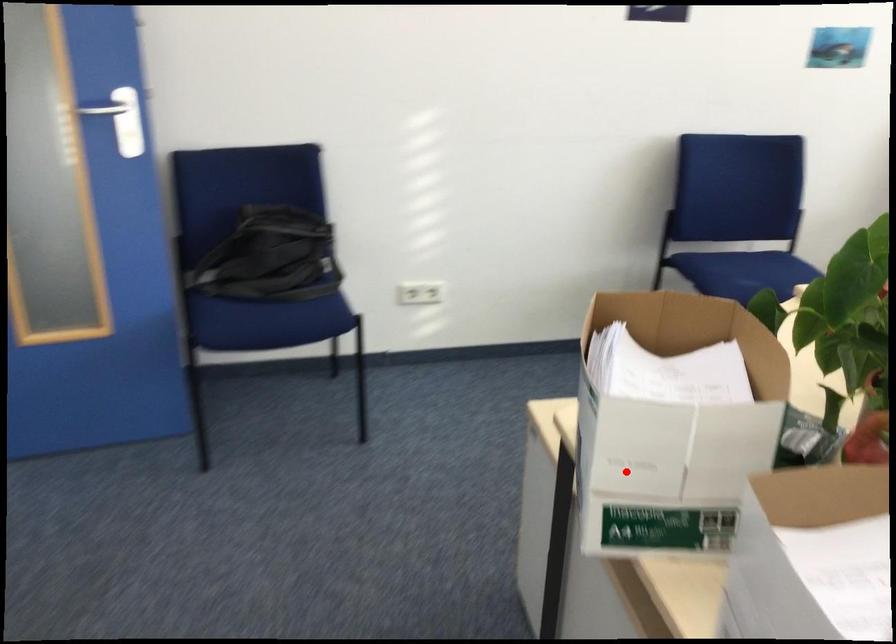
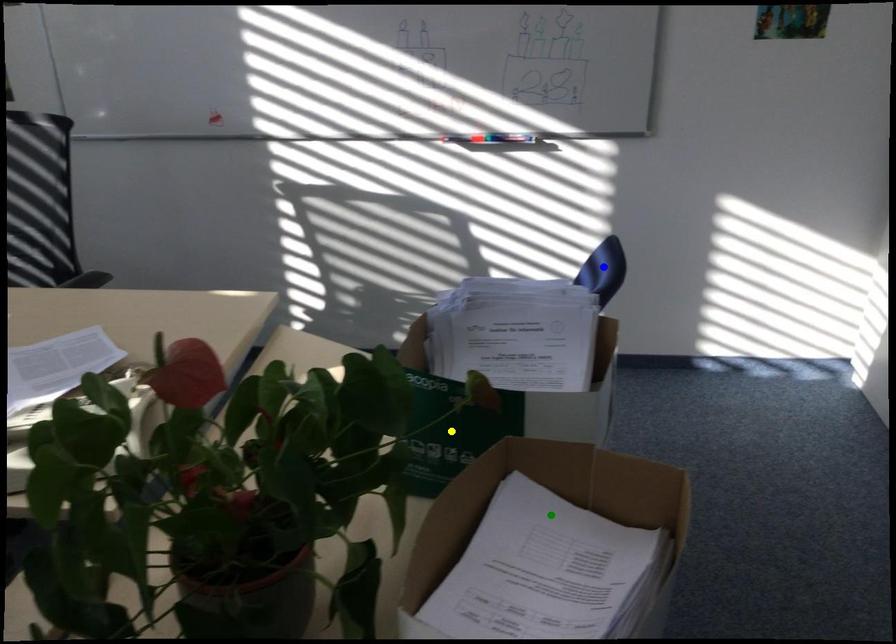
Question: I am providing you with two images of the same scene from different viewpoints. A red point is marked on the first image. You are given multiple points on the second image. Which point in image 2 is actually the same real-world point as the red point in image 1?

Choices:
 (A) yellow point
 (B) blue point
 (C) green point

Answer: (C)